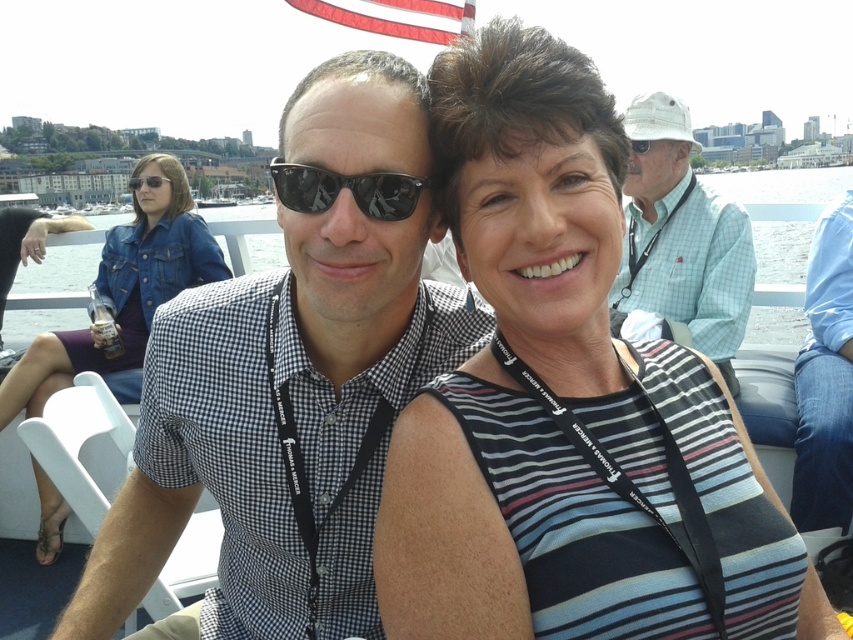
How distant is denim jacket at left from blue denim jeans at lower right?

The distance of denim jacket at left from blue denim jeans at lower right is 125.57 feet.

Which is below, denim jacket at left or blue denim jeans at lower right?

Positioned lower is blue denim jeans at lower right.

Between point (141, 344) and point (831, 253), which one is positioned behind?

Positioned behind is point (141, 344).

Where is `denim jacket at left`? Image resolution: width=853 pixels, height=640 pixels. denim jacket at left is located at coordinates (123, 289).

Does blue denim jeans at lower right have a greater width compared to black reflective sunglasses at center?

Correct, the width of blue denim jeans at lower right exceeds that of black reflective sunglasses at center.

Between point (843, 202) and point (363, 211), which one is positioned in front?

Point (363, 211) is in front.

Between point (822, 262) and point (303, 179), which one is positioned in front?

Point (303, 179) is in front.

Find the location of a particular element. blue denim jeans at lower right is located at coordinates (825, 380).

Who is taller, checkered fabric shirt at center or blue denim jeans at lower right?

With more height is checkered fabric shirt at center.

Does checkered fabric shirt at center appear over blue denim jeans at lower right?

Incorrect, checkered fabric shirt at center is not positioned above blue denim jeans at lower right.

Locate an element on the screen. This screenshot has height=640, width=853. checkered fabric shirt at center is located at coordinates (279, 428).